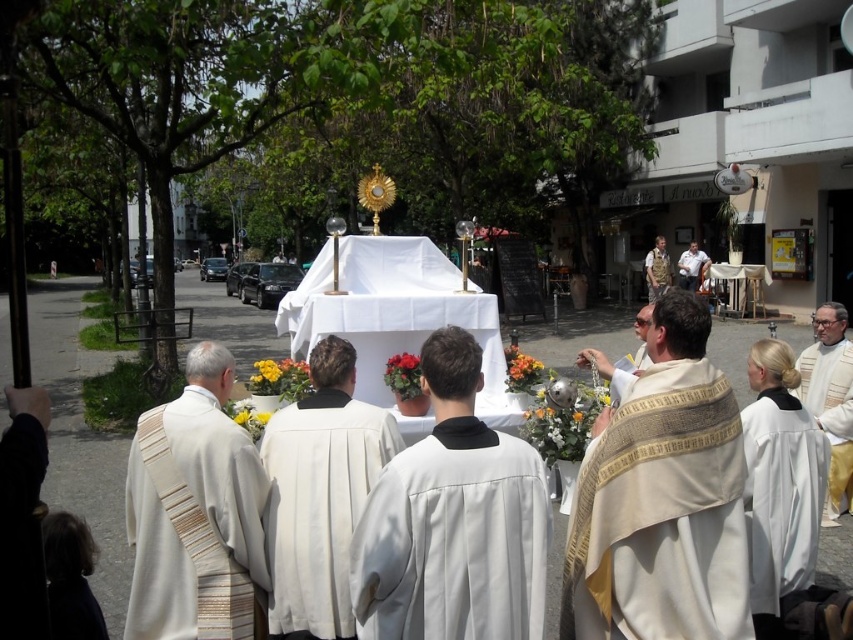
You are a photographer capturing the religious procession. You notice two items at the center of the scene, the white matte robe at center and the light brown leather jacket at center. Which item is positioned lower in the image?

The white matte robe at center is located below the light brown leather jacket at center, so it is positioned lower in the image.

You are a photographer standing at the edge of the religious procession. You need to capture a closeup shot of the white matte robe at center without moving the robe itself. Based on its position, will you need to adjust your camera angle upwards or downwards to focus on it?

The white matte robe at center is located at point (453,520), which means it is positioned slightly above the center of the image. To focus on it, you would need to adjust your camera angle upwards slightly.